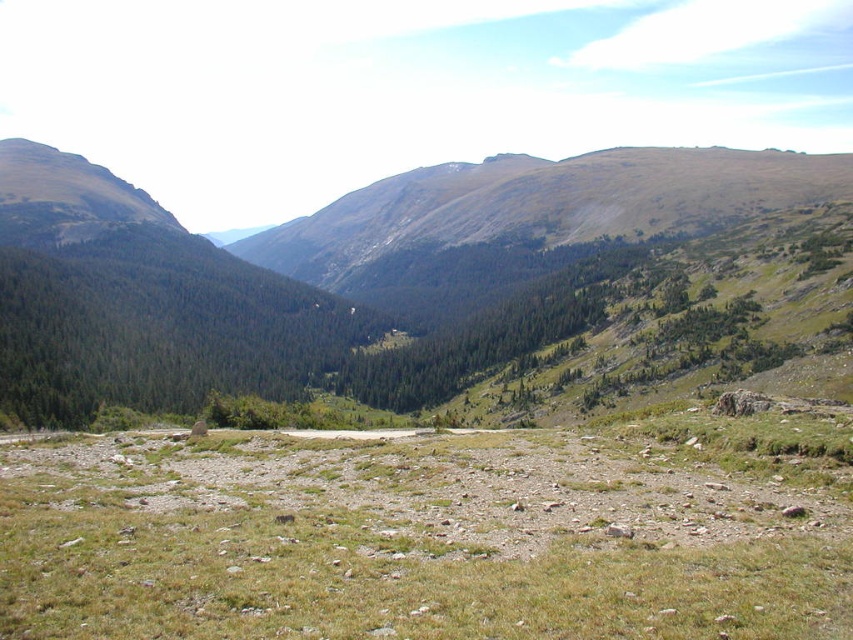
Question: Which point is farther to the camera?

Choices:
 (A) green grassy terrain at center
 (B) green grassy mountain at left

Answer: (B)

Question: Does green grassy terrain at center appear over green grassy mountain at left?

Choices:
 (A) yes
 (B) no

Answer: (B)

Question: Which of the following is the closest to the observer?

Choices:
 (A) green grassy mountain at left
 (B) green grassy terrain at center

Answer: (B)

Question: Is green grassy terrain at center thinner than green grassy mountain at left?

Choices:
 (A) no
 (B) yes

Answer: (B)

Question: Can you confirm if green grassy terrain at center is positioned below green grassy mountain at left?

Choices:
 (A) no
 (B) yes

Answer: (B)